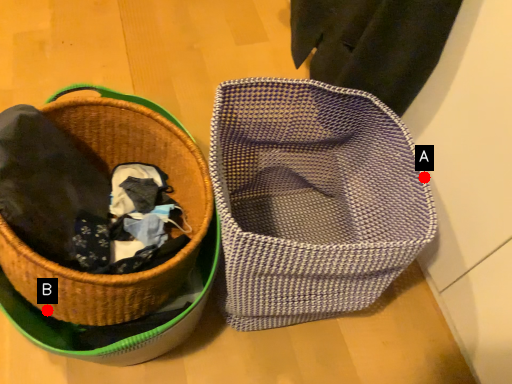
Question: Two points are circled on the image, labeled by A and B beside each circle. Which point appears farthest from the camera in this image?

Choices:
 (A) A is further
 (B) B is further

Answer: (B)